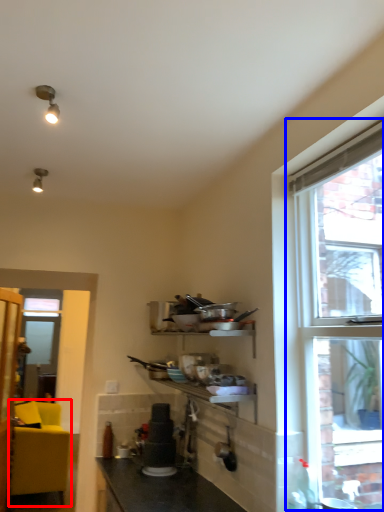
Question: Among these objects, which one is nearest to the camera, studio couch (highlighted by a red box) or window (highlighted by a blue box)?

Choices:
 (A) studio couch
 (B) window

Answer: (B)